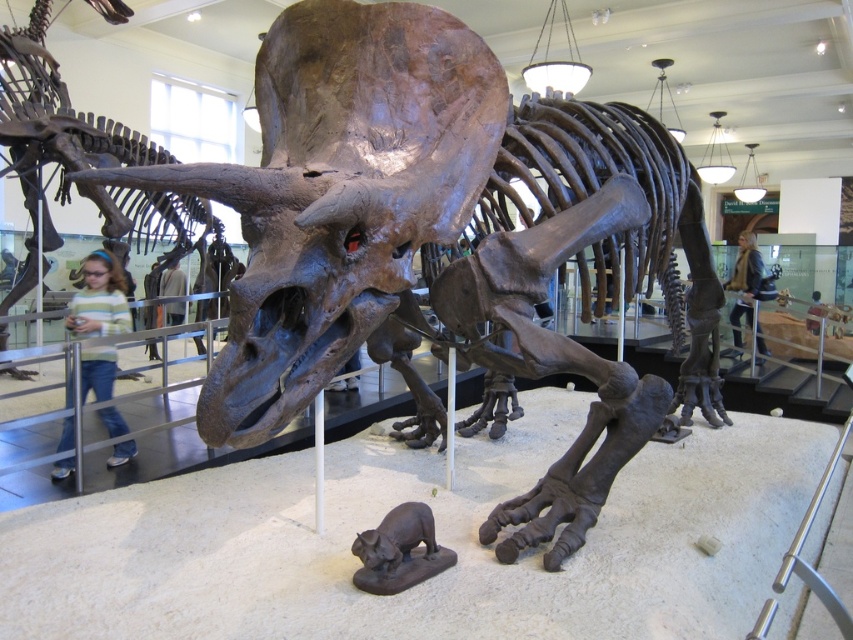
Question: Does rusty metallic dinosaur at center have a smaller size compared to shiny black statue at lower center?

Choices:
 (A) no
 (B) yes

Answer: (A)

Question: Which point appears farthest from the camera in this image?

Choices:
 (A) (409, 541)
 (B) (120, 16)

Answer: (B)

Question: Does rusty metallic dinosaur at center lie in front of shiny black statue at lower center?

Choices:
 (A) no
 (B) yes

Answer: (A)

Question: Which point appears farthest from the camera in this image?

Choices:
 (A) (109, 134)
 (B) (386, 522)

Answer: (A)

Question: Among these points, which one is farthest from the camera?

Choices:
 (A) (125, 125)
 (B) (433, 531)

Answer: (A)

Question: In this image, where is rusty metallic dinosaur at center located relative to shiny black statue at lower center?

Choices:
 (A) left
 (B) right

Answer: (A)